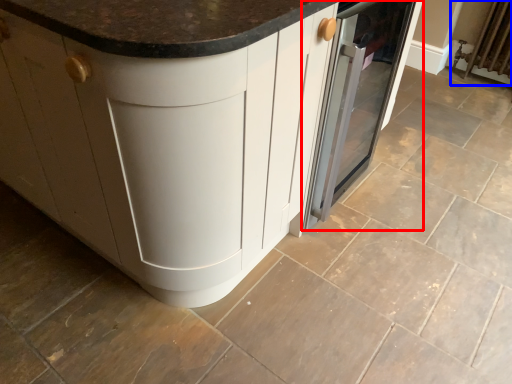
Question: Which object appears closest to the camera in this image, home appliance (highlighted by a red box) or radiator (highlighted by a blue box)?

Choices:
 (A) home appliance
 (B) radiator

Answer: (A)